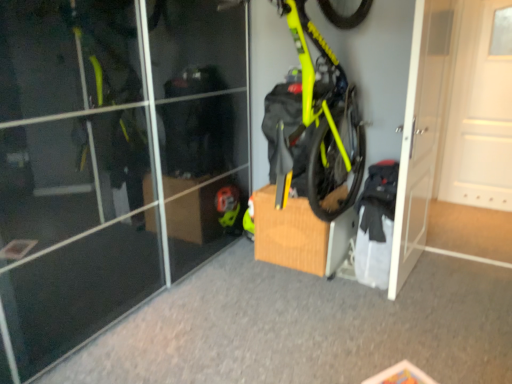
How much space does white matte door at right, which appears as the first door when viewed from the right, occupy horizontally?

white matte door at right, which appears as the first door when viewed from the right, is 17.50 centimeters in width.

This screenshot has height=384, width=512. Describe the element at coordinates (325, 118) in the screenshot. I see `neon yellow matte bicycle at center` at that location.

What is the approximate width of brown cardboard box at center?

20.65 inches.

At what (x,y) coordinates should I click in order to perform the action: click on white glossy door at center right, marked as the second door in a right-to-left arrangement. Please return your answer as a coordinate pair (x, y). The width and height of the screenshot is (512, 384). Looking at the image, I should click on (421, 133).

Can you confirm if brown cardboard box at center is bigger than white glossy door at center right, marked as the second door in a right-to-left arrangement?

No.

Considering their positions, is brown cardboard box at center located in front of or behind white glossy door at center right, positioned as the first door in left-to-right order?

Clearly, brown cardboard box at center is behind white glossy door at center right, positioned as the first door in left-to-right order.

Find the location of `cardboard box located below the white glossy door at center right, marked as the second door in a right-to-left arrangement (from the image's perspective)`. cardboard box located below the white glossy door at center right, marked as the second door in a right-to-left arrangement (from the image's perspective) is located at coordinates (300, 234).

Which object is positioned more to the right, neon yellow matte bicycle at center or white glossy door at center right, positioned as the first door in left-to-right order?

Positioned to the right is white glossy door at center right, positioned as the first door in left-to-right order.

Between neon yellow matte bicycle at center and white glossy door at center right, marked as the second door in a right-to-left arrangement, which one has smaller size?

white glossy door at center right, marked as the second door in a right-to-left arrangement.

From a real-world perspective, relative to white glossy door at center right, marked as the second door in a right-to-left arrangement, is neon yellow matte bicycle at center vertically above or below?

Clearly, from a real-world perspective, neon yellow matte bicycle at center is above white glossy door at center right, marked as the second door in a right-to-left arrangement.

Between neon yellow matte bicycle at center and white glossy door at center right, positioned as the first door in left-to-right order, which one has less height?

neon yellow matte bicycle at center.

Looking at this image, does white glossy door at center right, marked as the second door in a right-to-left arrangement, have a lesser width compared to white matte door at right, which ranks as the 2th door in left-to-right order?

Yes.

Which object is closer to the camera taking this photo, white glossy door at center right, marked as the second door in a right-to-left arrangement, or white matte door at right, which ranks as the 2th door in left-to-right order?

white glossy door at center right, marked as the second door in a right-to-left arrangement, is in front.

In the scene shown: How different are the orientations of white glossy door at center right, marked as the second door in a right-to-left arrangement, and white matte door at right, which ranks as the 2th door in left-to-right order, in degrees?

86.3 degrees.

There is a white glossy door at center right, marked as the second door in a right-to-left arrangement. What are the coordinates of `door above it (from a real-world perspective)` in the screenshot? It's located at (480, 111).

Does brown cardboard box at center turn towards neon yellow matte bicycle at center?

No.

Does brown cardboard box at center lie behind neon yellow matte bicycle at center?

Yes, brown cardboard box at center is further from the camera.

Is brown cardboard box at center at the right side of neon yellow matte bicycle at center?

No.

Is brown cardboard box at center taller or shorter than white matte door at right, which appears as the first door when viewed from the right?

Considering their sizes, brown cardboard box at center has less height than white matte door at right, which appears as the first door when viewed from the right.

Is brown cardboard box at center smaller than white matte door at right, which appears as the first door when viewed from the right?

Yes.

Is brown cardboard box at center positioned beyond the bounds of white matte door at right, which ranks as the 2th door in left-to-right order?

Yes.

Are brown cardboard box at center and white matte door at right, which ranks as the 2th door in left-to-right order, far apart?

Yes, brown cardboard box at center is far from white matte door at right, which ranks as the 2th door in left-to-right order.

Can you see neon yellow matte bicycle at center touching brown cardboard box at center?

No.

Between neon yellow matte bicycle at center and brown cardboard box at center, which one has less height?

With less height is brown cardboard box at center.

How many degrees apart are the facing directions of white matte door at right, which appears as the first door when viewed from the right, and neon yellow matte bicycle at center?

2.57 degrees.

From a real-world perspective, which is physically above, white matte door at right, which ranks as the 2th door in left-to-right order, or neon yellow matte bicycle at center?

From a 3D spatial view, neon yellow matte bicycle at center is above.

The width and height of the screenshot is (512, 384). Identify the location of door that is the 2nd object located behind the neon yellow matte bicycle at center. (480, 111).

Is white matte door at right, which ranks as the 2th door in left-to-right order, facing away from neon yellow matte bicycle at center?

No, white matte door at right, which ranks as the 2th door in left-to-right order, is not facing the opposite direction of neon yellow matte bicycle at center.

From the brown cardboard box at center, count 1st door to the right and point to it. Please provide its 2D coordinates.

[(421, 133)]

I want to click on bicycle that appears above the white glossy door at center right, marked as the second door in a right-to-left arrangement (from a real-world perspective), so click(325, 118).

Looking at the image, which one is located further to brown cardboard box at center, white glossy door at center right, marked as the second door in a right-to-left arrangement, or white matte door at right, which ranks as the 2th door in left-to-right order?

white matte door at right, which ranks as the 2th door in left-to-right order, is further to brown cardboard box at center.

Which object lies nearer to the anchor point white matte door at right, which ranks as the 2th door in left-to-right order, neon yellow matte bicycle at center or brown cardboard box at center?

neon yellow matte bicycle at center is closer to white matte door at right, which ranks as the 2th door in left-to-right order.

Considering their positions, is white glossy door at center right, positioned as the first door in left-to-right order, positioned further to neon yellow matte bicycle at center than white matte door at right, which ranks as the 2th door in left-to-right order?

The object further to neon yellow matte bicycle at center is white matte door at right, which ranks as the 2th door in left-to-right order.

In the scene shown: When comparing their distances from neon yellow matte bicycle at center, does brown cardboard box at center or white matte door at right, which ranks as the 2th door in left-to-right order, seem closer?

brown cardboard box at center is positioned closer to the anchor neon yellow matte bicycle at center.

Estimate the real-world distances between objects in this image. Which object is closer to neon yellow matte bicycle at center, white glossy door at center right, marked as the second door in a right-to-left arrangement, or brown cardboard box at center?

brown cardboard box at center is positioned closer to the anchor neon yellow matte bicycle at center.

When comparing their distances from white matte door at right, which ranks as the 2th door in left-to-right order, does neon yellow matte bicycle at center or white glossy door at center right, marked as the second door in a right-to-left arrangement, seem further?

neon yellow matte bicycle at center is positioned further to the anchor white matte door at right, which ranks as the 2th door in left-to-right order.

Based on their spatial positions, is brown cardboard box at center or white matte door at right, which ranks as the 2th door in left-to-right order, further from white glossy door at center right, positioned as the first door in left-to-right order?

white matte door at right, which ranks as the 2th door in left-to-right order, lies further to white glossy door at center right, positioned as the first door in left-to-right order, than the other object.

When comparing their distances from white glossy door at center right, positioned as the first door in left-to-right order, does white matte door at right, which ranks as the 2th door in left-to-right order, or brown cardboard box at center seem closer?

Among the two, brown cardboard box at center is located nearer to white glossy door at center right, positioned as the first door in left-to-right order.

This screenshot has height=384, width=512. In order to click on door between brown cardboard box at center and white matte door at right, which ranks as the 2th door in left-to-right order, from left to right in this screenshot , I will do `click(421, 133)`.

You are a GUI agent. You are given a task and a screenshot of the screen. Output one action in this format:
    pyautogui.click(x=<x>, y=<y>)
    Task: Click on the door between neon yellow matte bicycle at center and white matte door at right, which ranks as the 2th door in left-to-right order, from left to right
    The height and width of the screenshot is (384, 512).
    Given the screenshot: What is the action you would take?
    pyautogui.click(x=421, y=133)

Find the location of a particular element. bicycle situated between brown cardboard box at center and white matte door at right, which ranks as the 2th door in left-to-right order, from left to right is located at coordinates (325, 118).